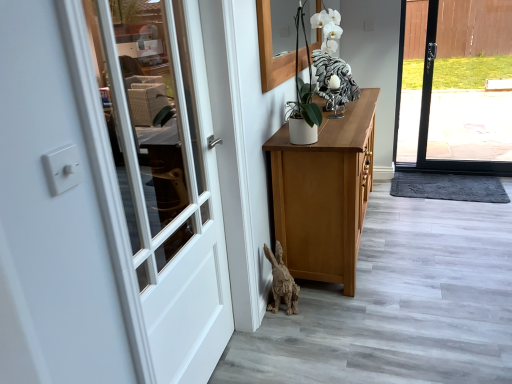
Question: Is white glossy rooster at upper center, placed as the 1th animal when sorted from back to front, at the right side of white wood door at left?

Choices:
 (A) yes
 (B) no

Answer: (A)

Question: Does white glossy rooster at upper center, the 2th animal positioned from the bottom, have a smaller size compared to white wood door at left?

Choices:
 (A) yes
 (B) no

Answer: (A)

Question: From the image's perspective, is white glossy rooster at upper center, acting as the second animal starting from the left, above white wood door at left?

Choices:
 (A) no
 (B) yes

Answer: (B)

Question: Would you say white glossy rooster at upper center, the 1th animal positioned from the top, contains white wood door at left?

Choices:
 (A) no
 (B) yes

Answer: (A)

Question: From a real-world perspective, does white glossy rooster at upper center, placed as the 1th animal when sorted from back to front, stand above white wood door at left?

Choices:
 (A) yes
 (B) no

Answer: (A)

Question: Which is correct: wooden rabbit at lower center, the second animal from the back, is inside white wood door at left, or outside of it?

Choices:
 (A) inside
 (B) outside

Answer: (B)

Question: In terms of width, does wooden rabbit at lower center, the second animal from the back, look wider or thinner when compared to white wood door at left?

Choices:
 (A) wide
 (B) thin

Answer: (A)

Question: Is point (281, 264) closer or farther from the camera than point (201, 243)?

Choices:
 (A) farther
 (B) closer

Answer: (A)

Question: In terms of height, does wooden rabbit at lower center, the 1th animal positioned from the bottom, look taller or shorter compared to white wood door at left?

Choices:
 (A) tall
 (B) short

Answer: (B)

Question: Based on their sizes in the image, would you say wooden rabbit at lower center, which is the second animal in top-to-bottom order, is bigger or smaller than dark gray textured mat at lower right?

Choices:
 (A) small
 (B) big

Answer: (B)

Question: Considering the relative positions of wooden rabbit at lower center, the 1th animal positioned from the bottom, and dark gray textured mat at lower right in the image provided, is wooden rabbit at lower center, the 1th animal positioned from the bottom, to the left or to the right of dark gray textured mat at lower right?

Choices:
 (A) right
 (B) left

Answer: (B)

Question: Is wooden rabbit at lower center, arranged as the first animal when viewed from the front, in front of or behind dark gray textured mat at lower right in the image?

Choices:
 (A) behind
 (B) front

Answer: (B)

Question: In terms of height, does wooden rabbit at lower center, which is the second animal in top-to-bottom order, look taller or shorter compared to dark gray textured mat at lower right?

Choices:
 (A) tall
 (B) short

Answer: (A)

Question: In terms of height, does wooden rabbit at lower center, the 1th animal viewed from the left, look taller or shorter compared to white glossy rooster at upper center, placed as the 1th animal when sorted from back to front?

Choices:
 (A) short
 (B) tall

Answer: (B)

Question: Looking at their shapes, would you say wooden rabbit at lower center, the second animal viewed from the right, is wider or thinner than white glossy rooster at upper center, acting as the second animal starting from the left?

Choices:
 (A) wide
 (B) thin

Answer: (B)